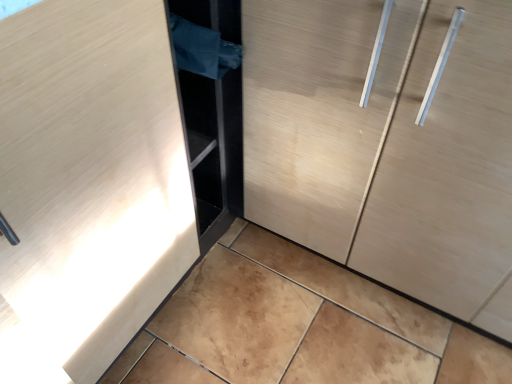
This screenshot has height=384, width=512. What do you see at coordinates (387, 145) in the screenshot?
I see `transparent glass cabinet at left` at bounding box center [387, 145].

Locate an element on the screen. The width and height of the screenshot is (512, 384). transparent glass cabinet at left is located at coordinates (387, 145).

Where is `transparent glass cabinet at left`? transparent glass cabinet at left is located at coordinates (387, 145).